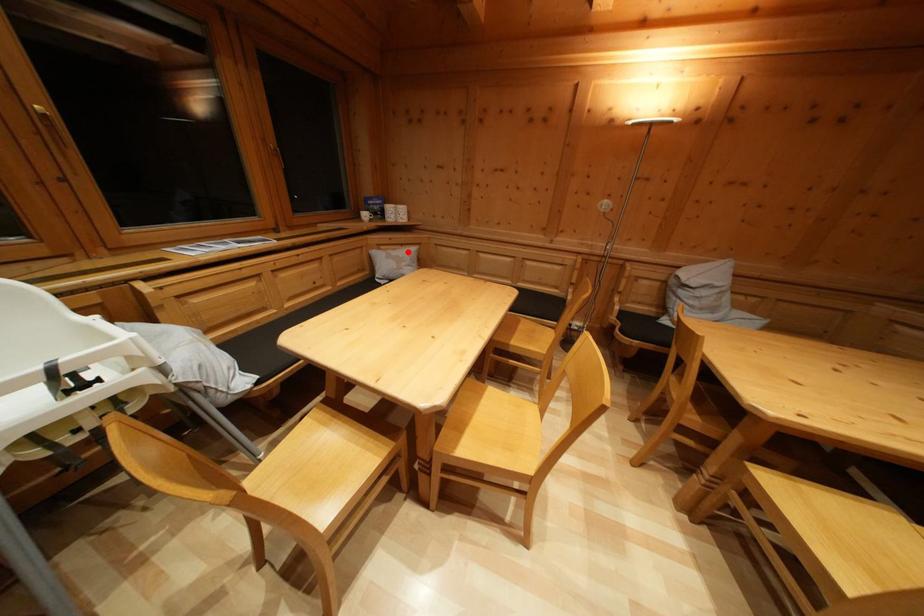
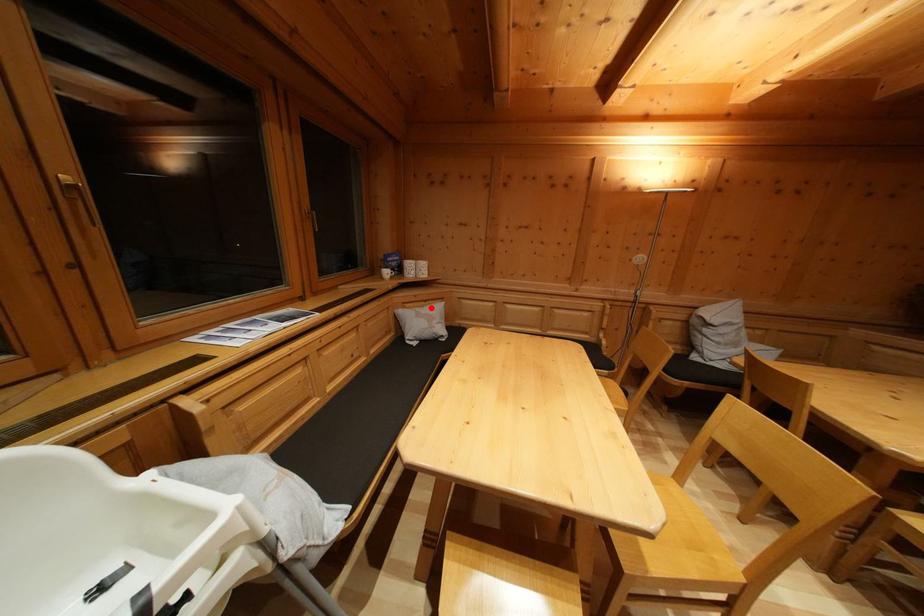
I am providing you with two images of the same scene from different viewpoints. A red point is marked on the first image and another point is marked on the second image. Is the marked point in image1 the same physical position as the marked point in image2?

Yes